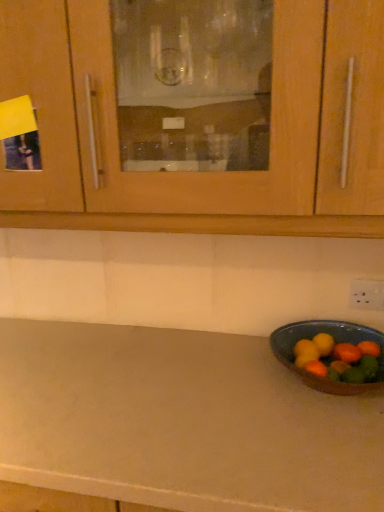
Where is `orange matte/orange at right`? The image size is (384, 512). orange matte/orange at right is located at coordinates (347, 353).

Measure the distance between point (355, 349) and camera.

They are 3.48 feet apart.

The image size is (384, 512). Describe the element at coordinates (347, 353) in the screenshot. I see `orange matte/orange at right` at that location.

This screenshot has height=512, width=384. Identify the location of wooden cabinet at upper center. (179, 213).

The image size is (384, 512). What do you see at coordinates (179, 213) in the screenshot?
I see `wooden cabinet at upper center` at bounding box center [179, 213].

Locate an element on the screen. This screenshot has width=384, height=512. orange matte/orange at right is located at coordinates (347, 353).

Which is more to the right, wooden cabinet at upper center or orange matte/orange at right?

From the viewer's perspective, orange matte/orange at right appears more on the right side.

Is wooden cabinet at upper center behind orange matte/orange at right?

No, it is not.

Between point (329, 226) and point (349, 361), which one is positioned behind?

The point (349, 361) is farther from the camera.

From the image's perspective, is wooden cabinet at upper center on top of orange matte/orange at right?

Yes, from the image's perspective, wooden cabinet at upper center is on top of orange matte/orange at right.

From a real-world perspective, is wooden cabinet at upper center located higher than orange matte/orange at right?

Correct, in the physical world, wooden cabinet at upper center is higher than orange matte/orange at right.

Can you confirm if wooden cabinet at upper center is wider than orange matte/orange at right?

Yes.

Considering the relative sizes of wooden cabinet at upper center and orange matte/orange at right in the image provided, is wooden cabinet at upper center taller than orange matte/orange at right?

Indeed, wooden cabinet at upper center has a greater height compared to orange matte/orange at right.

From the picture: Between wooden cabinet at upper center and orange matte/orange at right, which one has smaller size?

With smaller size is orange matte/orange at right.

Can orange matte/orange at right be found inside wooden cabinet at upper center?

No, orange matte/orange at right is not inside wooden cabinet at upper center.

Is there a large distance between wooden cabinet at upper center and orange matte/orange at right?

No, wooden cabinet at upper center is not far from orange matte/orange at right.

Could you tell me if wooden cabinet at upper center is turned towards orange matte/orange at right?

No, wooden cabinet at upper center is not aimed at orange matte/orange at right.

Image resolution: width=384 pixels, height=512 pixels. I want to click on fruit behind the wooden cabinet at upper center, so [347, 353].

Is orange matte/orange at right to the left of wooden cabinet at upper center from the viewer's perspective?

In fact, orange matte/orange at right is to the right of wooden cabinet at upper center.

Which object is more forward, orange matte/orange at right or wooden cabinet at upper center?

wooden cabinet at upper center.

Is point (351, 348) behind point (309, 192)?

Yes, point (351, 348) is behind point (309, 192).

From the image's perspective, is orange matte/orange at right located above or below wooden cabinet at upper center?

orange matte/orange at right is situated lower than wooden cabinet at upper center in the image.

From a real-world perspective, is orange matte/orange at right physically below wooden cabinet at upper center?

Yes, from a real-world perspective, orange matte/orange at right is beneath wooden cabinet at upper center.

Which object is thinner, orange matte/orange at right or wooden cabinet at upper center?

orange matte/orange at right is thinner.

Who is shorter, orange matte/orange at right or wooden cabinet at upper center?

orange matte/orange at right.

In the scene shown: Can you confirm if orange matte/orange at right is smaller than wooden cabinet at upper center?

Indeed, orange matte/orange at right has a smaller size compared to wooden cabinet at upper center.

Is orange matte/orange at right surrounding wooden cabinet at upper center?

No, wooden cabinet at upper center is not surrounded by orange matte/orange at right.

Is orange matte/orange at right directly adjacent to wooden cabinet at upper center?

No.

Is wooden cabinet at upper center at the back of orange matte/orange at right?

No, orange matte/orange at right's orientation is not away from wooden cabinet at upper center.

Can you tell me how much orange matte/orange at right and wooden cabinet at upper center differ in facing direction?

There is a 0.462-degree angle between the facing directions of orange matte/orange at right and wooden cabinet at upper center.

Locate an element on the screen. fruit lying on the right of wooden cabinet at upper center is located at coordinates (347, 353).

Where is `cabinetry on the left of the orange matte/orange at right`? cabinetry on the left of the orange matte/orange at right is located at coordinates (179, 213).

At what (x,y) coordinates should I click in order to perform the action: click on fruit that appears on the right of wooden cabinet at upper center. Please return your answer as a coordinate pair (x, y). Looking at the image, I should click on (347, 353).